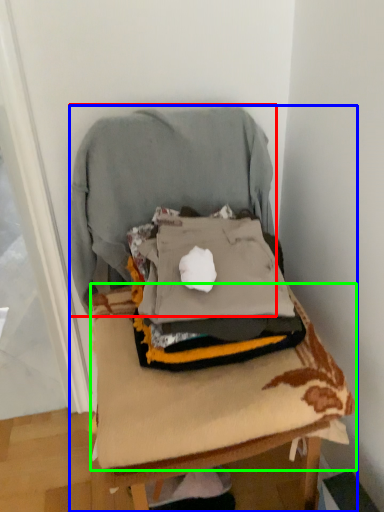
Question: Which is nearer to the sweatshirt (highlighted by a red box)? furniture (highlighted by a blue box) or sheet (highlighted by a green box).

Choices:
 (A) furniture
 (B) sheet

Answer: (A)